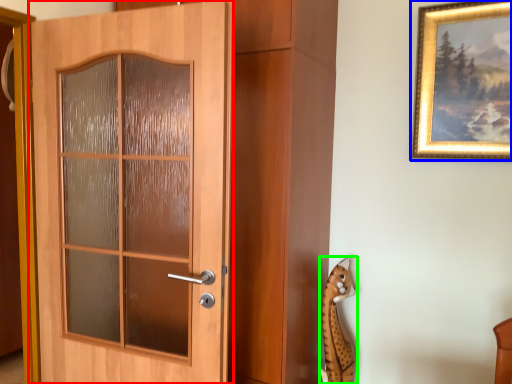
Question: Based on their relative distances, which object is farther from door (highlighted by a red box)? Choose from picture frame (highlighted by a blue box) and animal (highlighted by a green box).

Choices:
 (A) picture frame
 (B) animal

Answer: (A)